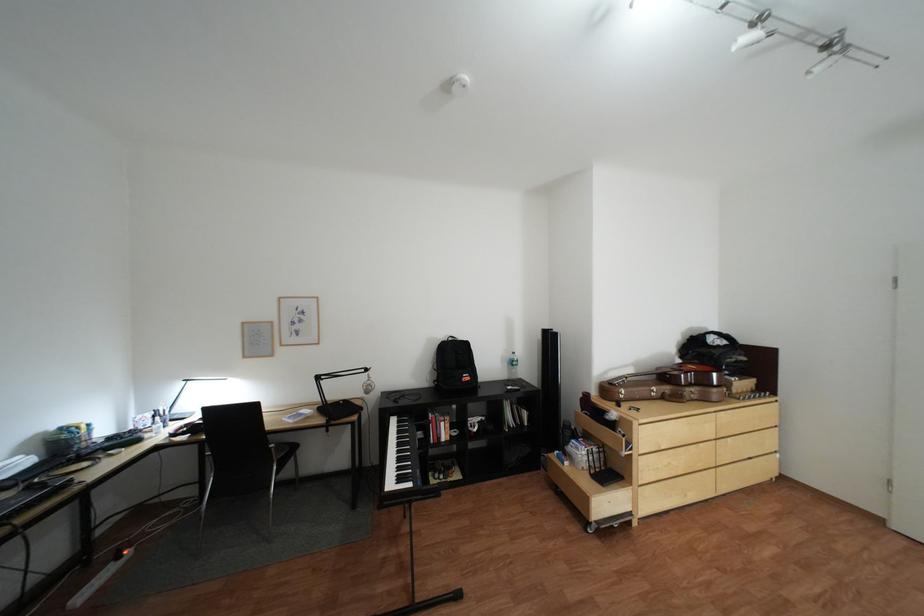
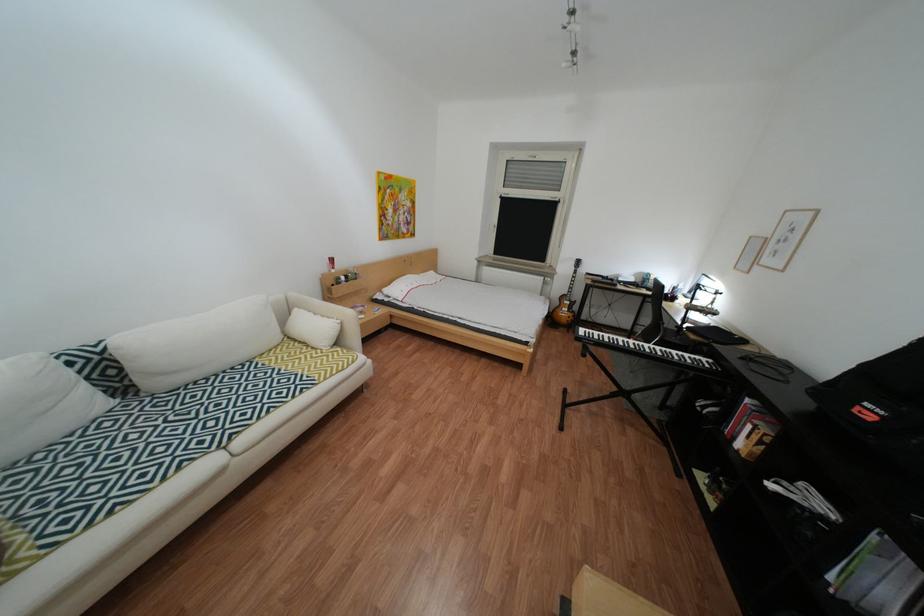
Question: I am providing you with two images of the same scene from different viewpoints. Which of the following objects are not visible in image2?

Choices:
 (A) chair sitting surface
 (B) pink bath sponge
 (C) electric guitar
 (D) red spray bottle

Answer: (A)